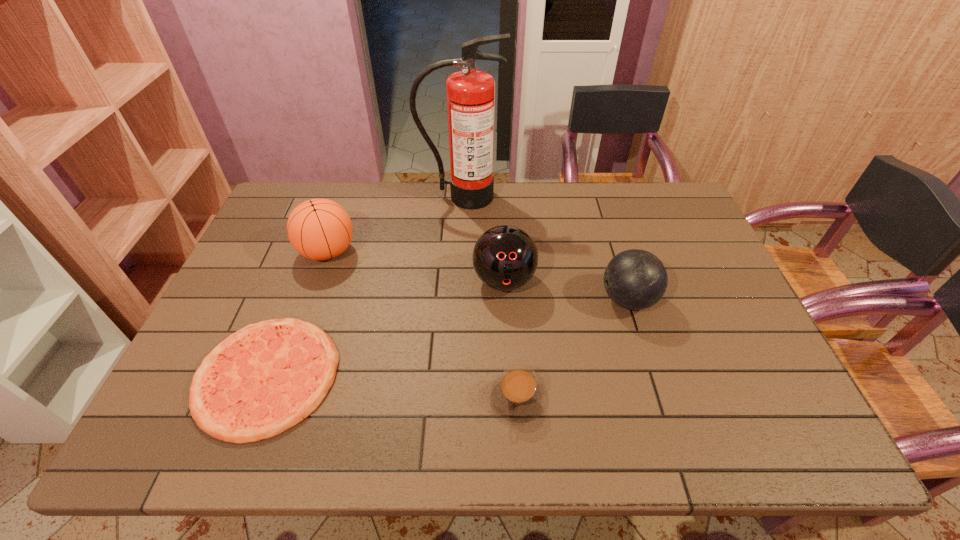
This screenshot has width=960, height=540. I want to click on free spot between the shortest object and the right bowling ball, so click(447, 338).

The width and height of the screenshot is (960, 540). What are the coordinates of `unoccupied position between the shortest object and the cappuccino` in the screenshot? It's located at (393, 387).

The height and width of the screenshot is (540, 960). In order to click on empty space between the basketball and the left bowling ball in this screenshot , I will do coord(416,266).

At what (x,y) coordinates should I click in order to perform the action: click on unoccupied position between the second shortest object and the basketball. Please return your answer as a coordinate pair (x, y). The width and height of the screenshot is (960, 540). Looking at the image, I should click on (422, 325).

This screenshot has height=540, width=960. Identify the location of object that is the fifth closest to the basketball. (635, 279).

Find the location of `object that is the third closest to the pizza`. object that is the third closest to the pizza is located at coordinates (517, 395).

Find the location of a particular element. The image size is (960, 540). vacant space that satisfies the following two spatial constraints: 1. on the surface of the fifth tallest object near the finger holes; 2. on the left side of the left bowling ball is located at coordinates (510, 398).

Find the location of a particular element. This screenshot has height=540, width=960. vacant area in the image that satisfies the following two spatial constraints: 1. on the front-facing side of the tallest object; 2. on the left side of the second shortest object is located at coordinates 452,398.

This screenshot has width=960, height=540. In order to click on free space that satisfies the following two spatial constraints: 1. on the surface of the left bowling ball near the finger holes; 2. on the left side of the cappuccino in this screenshot , I will do `click(510, 398)`.